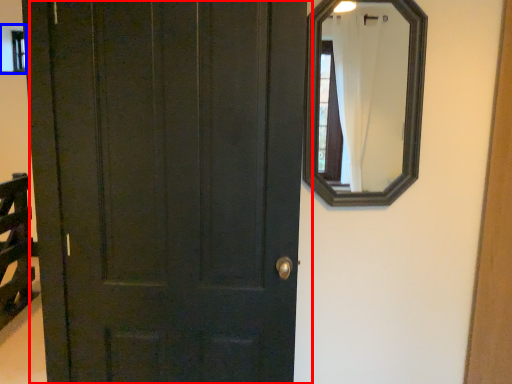
Question: Which object is further to the camera taking this photo, door (highlighted by a red box) or window (highlighted by a blue box)?

Choices:
 (A) door
 (B) window

Answer: (B)